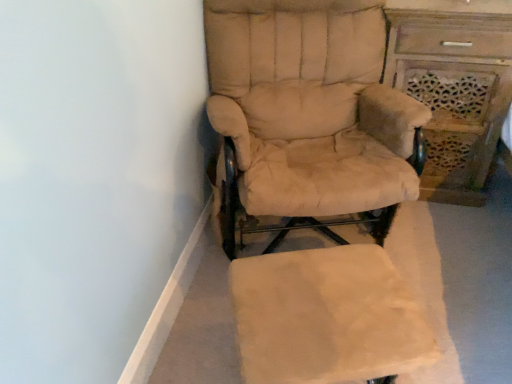
Question: From the image's perspective, is wooden carved vanity at right located above or below beige fabric chair at center?

Choices:
 (A) below
 (B) above

Answer: (B)

Question: In the image, is wooden carved vanity at right on the left side or the right side of beige fabric chair at center?

Choices:
 (A) left
 (B) right

Answer: (B)

Question: Estimate the real-world distances between objects in this image. Which object is farther from the beige fabric chair at center?

Choices:
 (A) wooden carved vanity at right
 (B) beige fabric ottoman at lower center

Answer: (A)

Question: Considering the real-world distances, which object is farthest from the beige fabric chair at center?

Choices:
 (A) beige fabric ottoman at lower center
 (B) wooden carved vanity at right

Answer: (B)